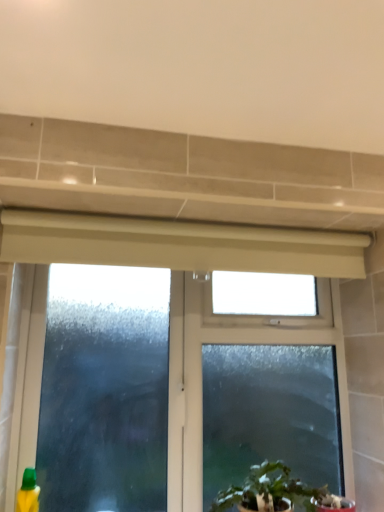
The width and height of the screenshot is (384, 512). What do you see at coordinates (28, 492) in the screenshot?
I see `green plastic bottle at lower left` at bounding box center [28, 492].

Find the location of a particular element. green leafy plant at lower center is located at coordinates (268, 489).

Where is `green plastic bottle at lower left`? This screenshot has height=512, width=384. green plastic bottle at lower left is located at coordinates (28, 492).

Is green plastic bottle at lower left facing away from frosted glass window at center?

Yes, green plastic bottle at lower left is facing away from frosted glass window at center.

In the scene shown: Can you confirm if green plastic bottle at lower left is shorter than frosted glass window at center?

Correct, green plastic bottle at lower left is not as tall as frosted glass window at center.

From the image's perspective, is green plastic bottle at lower left over frosted glass window at center?

No.

Based on the photo, can we say green plastic bottle at lower left lies outside frosted glass window at center?

That's correct, green plastic bottle at lower left is outside of frosted glass window at center.

From a real-world perspective, is frosted glass window at center on top of green plastic bottle at lower left?

Correct, in the physical world, frosted glass window at center is higher than green plastic bottle at lower left.

From the image's perspective, is frosted glass window at center above green plastic bottle at lower left?

Yes, from the image's perspective, frosted glass window at center is above green plastic bottle at lower left.

Considering the relative sizes of frosted glass window at center and green plastic bottle at lower left in the image provided, is frosted glass window at center bigger than green plastic bottle at lower left?

Yes, frosted glass window at center is bigger than green plastic bottle at lower left.

Is frosted glass window at center completely or partially inside green leafy plant at lower center?

No, green leafy plant at lower center does not contain frosted glass window at center.

From the picture: From the image's perspective, which one is positioned higher, green leafy plant at lower center or frosted glass window at center?

frosted glass window at center.

Based on the photo, looking at the image, does green leafy plant at lower center seem bigger or smaller compared to frosted glass window at center?

Considering their sizes, green leafy plant at lower center takes up less space than frosted glass window at center.

From a real-world perspective, is green leafy plant at lower center over frosted glass window at center?

Incorrect, from a real-world perspective, green leafy plant at lower center is lower than frosted glass window at center.

From a real-world perspective, is green plastic bottle at lower left positioned under green leafy plant at lower center based on gravity?

Yes.

Looking at this image, considering the positions of objects green plastic bottle at lower left and green leafy plant at lower center in the image provided, who is behind, green plastic bottle at lower left or green leafy plant at lower center?

Positioned behind is green plastic bottle at lower left.

From a real-world perspective, which object rests below the other?

In real-world perspective, green plastic bottle at lower left is lower.

From the picture: From the image's perspective, which is below, green leafy plant at lower center or green plastic bottle at lower left?

green plastic bottle at lower left is shown below in the image.

Is green leafy plant at lower center in front of green plastic bottle at lower left?

Yes, green leafy plant at lower center is closer to the viewer.

Is point (34, 270) positioned behind point (293, 492)?

That is True.

Is the depth of frosted glass window at center greater than that of green leafy plant at lower center?

Yes, the depth of frosted glass window at center is greater than that of green leafy plant at lower center.

Is frosted glass window at center facing towards green leafy plant at lower center?

Yes, frosted glass window at center is oriented towards green leafy plant at lower center.

From a real-world perspective, which object rests below the other?

From a 3D spatial view, green leafy plant at lower center is below.

Find the location of a particular element. Image resolution: width=384 pixels, height=512 pixels. window behind the green plastic bottle at lower left is located at coordinates (172, 308).

You are a GUI agent. You are given a task and a screenshot of the screen. Output one action in this format:
    pyautogui.click(x=<x>, y=<y>)
    Task: Click on the cleaning product lying in front of the frosted glass window at center
    The height and width of the screenshot is (512, 384).
    Given the screenshot: What is the action you would take?
    pyautogui.click(x=28, y=492)

Considering their positions, is green plastic bottle at lower left positioned closer to frosted glass window at center than green leafy plant at lower center?

Among the two, green leafy plant at lower center is located nearer to frosted glass window at center.

From the image, which object appears to be farther from green plastic bottle at lower left, frosted glass window at center or green leafy plant at lower center?

green leafy plant at lower center is positioned further to the anchor green plastic bottle at lower left.

Based on their spatial positions, is green leafy plant at lower center or green plastic bottle at lower left further from frosted glass window at center?

Based on the image, green plastic bottle at lower left appears to be further to frosted glass window at center.

When comparing their distances from green plastic bottle at lower left, does green leafy plant at lower center or frosted glass window at center seem further?

The object further to green plastic bottle at lower left is green leafy plant at lower center.

Consider the image. Looking at the image, which one is located closer to green leafy plant at lower center, frosted glass window at center or green plastic bottle at lower left?

Based on the image, frosted glass window at center appears to be nearer to green leafy plant at lower center.

Estimate the real-world distances between objects in this image. Which object is closer to green leafy plant at lower center, green plastic bottle at lower left or frosted glass window at center?

Among the two, frosted glass window at center is located nearer to green leafy plant at lower center.

The height and width of the screenshot is (512, 384). Identify the location of window between green plastic bottle at lower left and green leafy plant at lower center. (172, 308).